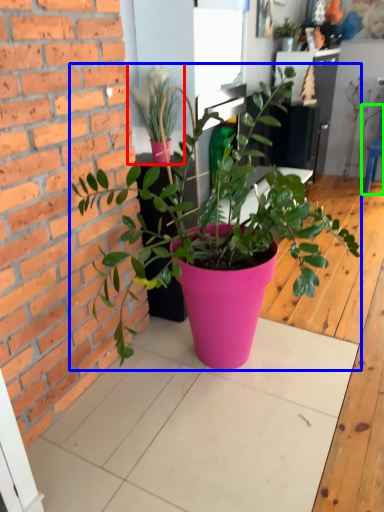
Question: Considering the real-world distances, which object is farthest from houseplant (highlighted by a red box)? houseplant (highlighted by a blue box) or chair (highlighted by a green box)?

Choices:
 (A) houseplant
 (B) chair

Answer: (B)